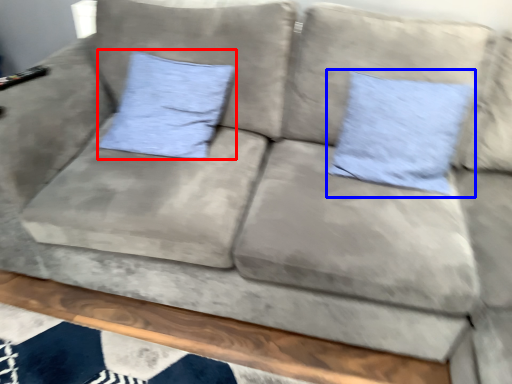
Question: Among these objects, which one is farthest to the camera, pillow (highlighted by a red box) or pillow (highlighted by a blue box)?

Choices:
 (A) pillow
 (B) pillow

Answer: (A)